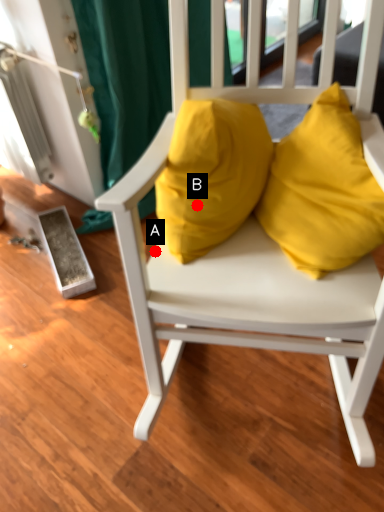
Question: Two points are circled on the image, labeled by A and B beside each circle. Among these points, which one is nearest to the camera?

Choices:
 (A) A is closer
 (B) B is closer

Answer: (B)